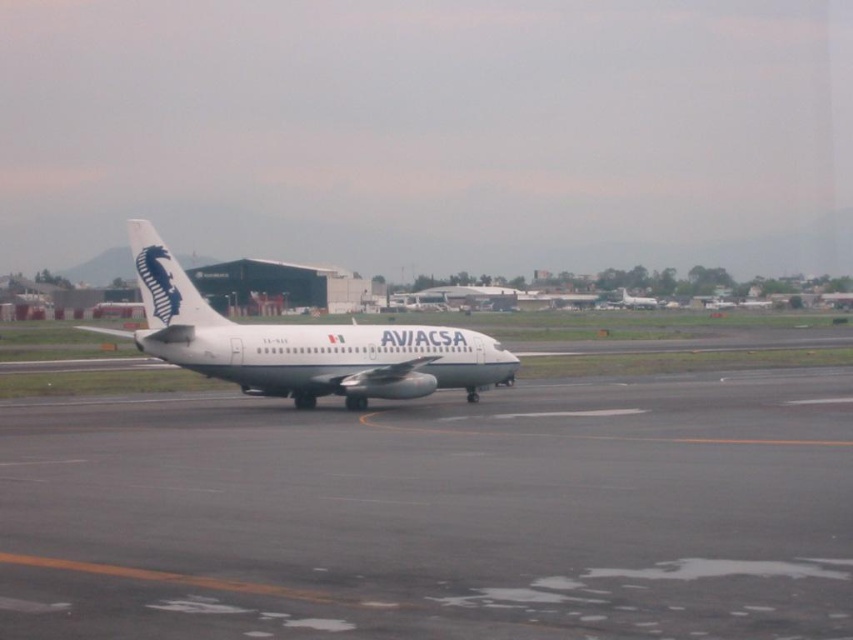
Does gray asphalt runway at center have a lesser height compared to white glossy airplane at center?

Indeed, gray asphalt runway at center has a lesser height compared to white glossy airplane at center.

Consider the image. Which of these two, gray asphalt runway at center or white glossy airplane at center, stands taller?

white glossy airplane at center is taller.

Between point (618, 509) and point (643, 301), which one is positioned behind?

Positioned behind is point (643, 301).

Image resolution: width=853 pixels, height=640 pixels. Identify the location of gray asphalt runway at center. (436, 515).

In the scene shown: Can you confirm if gray asphalt runway at center is shorter than white matte airplane at center?

Correct, gray asphalt runway at center is not as tall as white matte airplane at center.

Does gray asphalt runway at center have a greater height compared to white matte airplane at center?

In fact, gray asphalt runway at center may be shorter than white matte airplane at center.

The image size is (853, 640). Find the location of `gray asphalt runway at center`. gray asphalt runway at center is located at coordinates (436, 515).

Which is in front, point (488, 362) or point (636, 298)?

Point (488, 362) is in front.

Who is taller, white matte airplane at center or white glossy airplane at center?

white matte airplane at center is taller.

Who is more forward, (393, 394) or (643, 301)?

Positioned in front is point (393, 394).

The width and height of the screenshot is (853, 640). What are the coordinates of `white matte airplane at center` in the screenshot? It's located at (303, 344).